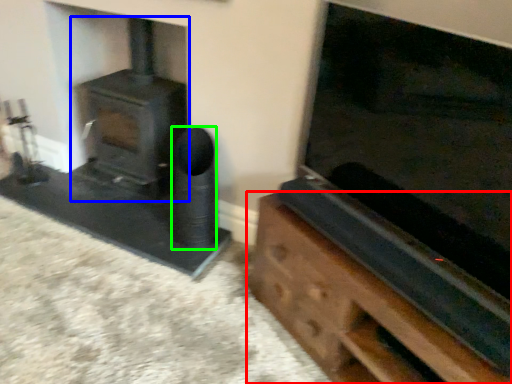
Question: Which is farther away from furniture (highlighted by a red box)? wood burning stove (highlighted by a blue box) or speaker (highlighted by a green box)?

Choices:
 (A) wood burning stove
 (B) speaker

Answer: (A)